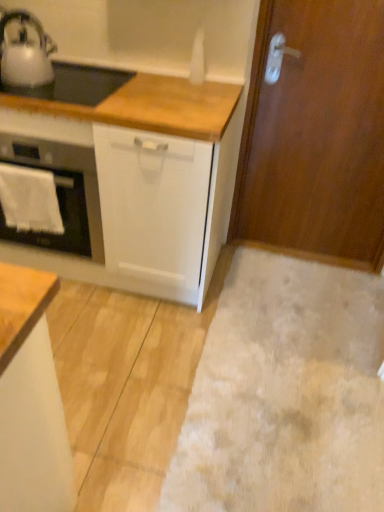
Question: From the image's perspective, is white towel at left under white glossy oven at left?

Choices:
 (A) no
 (B) yes

Answer: (B)

Question: Does white towel at left have a smaller size compared to white glossy oven at left?

Choices:
 (A) yes
 (B) no

Answer: (A)

Question: Does white towel at left come behind white glossy oven at left?

Choices:
 (A) yes
 (B) no

Answer: (A)

Question: From the image's perspective, is white towel at left on top of white glossy oven at left?

Choices:
 (A) yes
 (B) no

Answer: (B)

Question: Considering the relative sizes of white towel at left and white glossy oven at left in the image provided, is white towel at left wider than white glossy oven at left?

Choices:
 (A) no
 (B) yes

Answer: (A)

Question: Would you say white towel at left contains white glossy oven at left?

Choices:
 (A) yes
 (B) no

Answer: (B)

Question: From the image's perspective, is metallic silver kettle at upper left located above wooden door at right?

Choices:
 (A) yes
 (B) no

Answer: (A)

Question: Considering the relative sizes of metallic silver kettle at upper left and wooden door at right in the image provided, is metallic silver kettle at upper left wider than wooden door at right?

Choices:
 (A) no
 (B) yes

Answer: (B)

Question: Is metallic silver kettle at upper left positioned behind wooden door at right?

Choices:
 (A) no
 (B) yes

Answer: (A)

Question: Does metallic silver kettle at upper left appear on the left side of wooden door at right?

Choices:
 (A) no
 (B) yes

Answer: (B)

Question: From the image's perspective, does metallic silver kettle at upper left appear lower than wooden door at right?

Choices:
 (A) yes
 (B) no

Answer: (B)

Question: Does metallic silver kettle at upper left have a lesser height compared to wooden door at right?

Choices:
 (A) no
 (B) yes

Answer: (B)

Question: Is beige carpet at lower right outside of white matte cabinet at lower left?

Choices:
 (A) no
 (B) yes

Answer: (B)